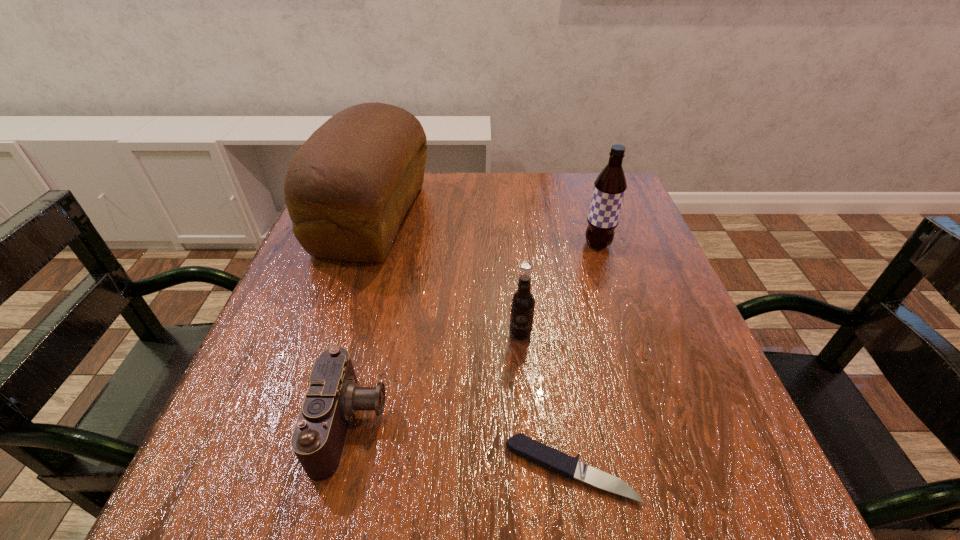
The height and width of the screenshot is (540, 960). What are the coordinates of `bread` in the screenshot? It's located at (347, 189).

I want to click on the taller root beer, so click(609, 187).

The width and height of the screenshot is (960, 540). What are the coordinates of `the farther root beer` in the screenshot? It's located at (609, 187).

Locate an element on the screen. The image size is (960, 540). the shorter root beer is located at coordinates 522,302.

At what (x,y) coordinates should I click in order to perform the action: click on the third shortest object. Please return your answer as a coordinate pair (x, y). This screenshot has width=960, height=540. Looking at the image, I should click on (522, 302).

Find the location of a particular element. The image size is (960, 540). the second shortest object is located at coordinates (333, 396).

Locate an element on the screen. This screenshot has height=540, width=960. the shortest object is located at coordinates (534, 451).

Locate an element on the screen. Image resolution: width=960 pixels, height=540 pixels. free location located 0.320m on the right of the bread is located at coordinates (555, 218).

Identify the location of vacant space located 0.150m on the left of the right root beer. This screenshot has width=960, height=540. (517, 245).

In order to click on free space located on the label of the third nearest object in this screenshot , I will do `click(532, 462)`.